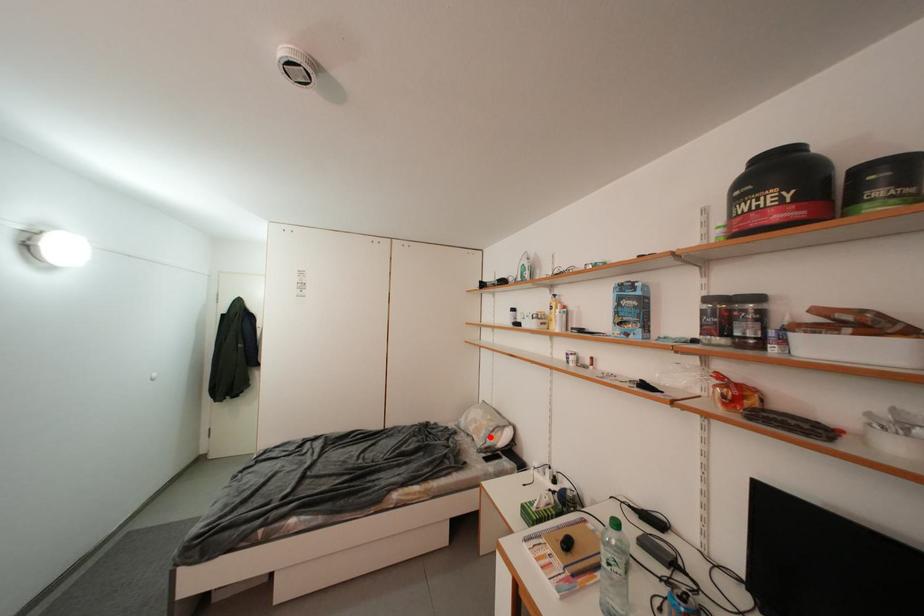
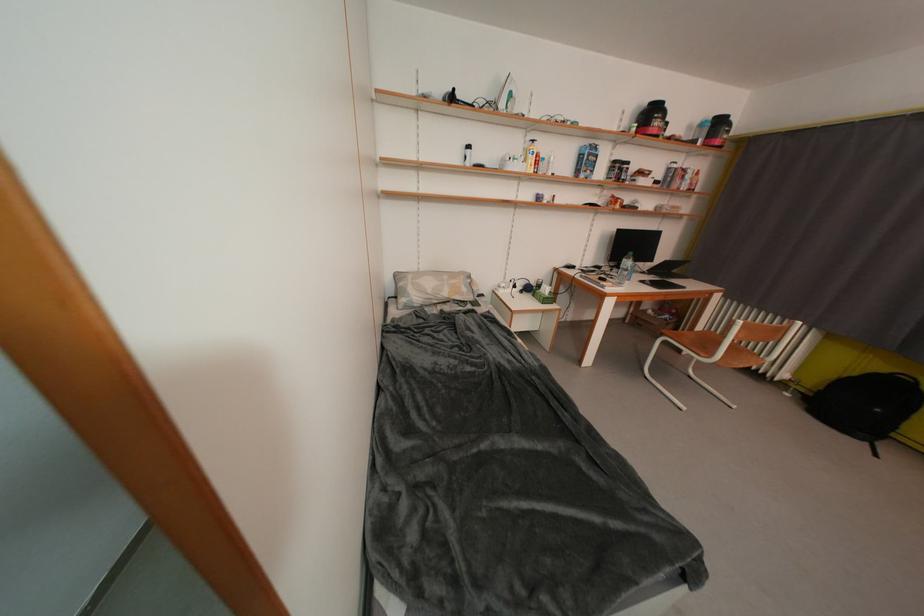
Question: A red point is marked in image1. In image2, is the corresponding 3D point closer to the camera or farther? Reply with the corresponding letter.

Choices:
 (A) The corresponding 3D point is closer.
 (B) The corresponding 3D point is farther.

Answer: (A)